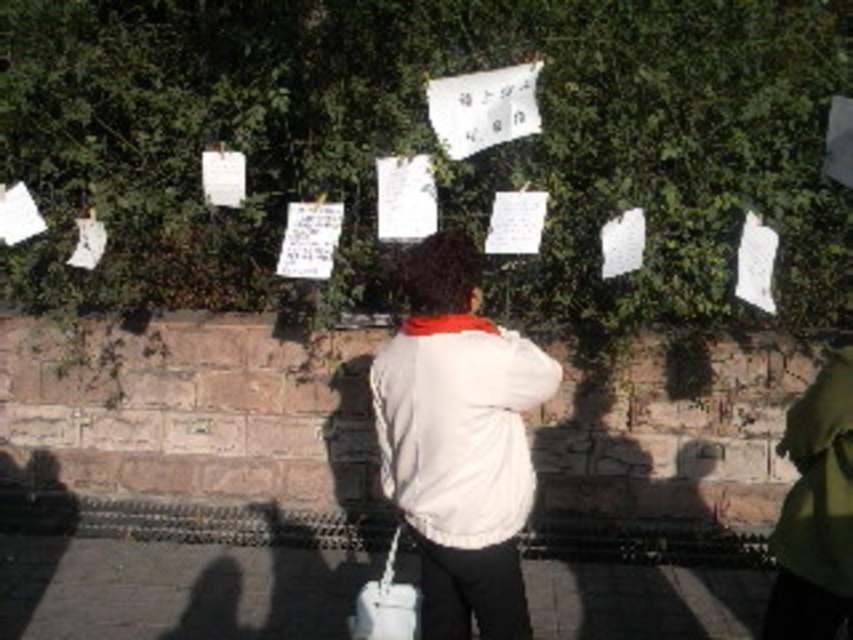
Question: Does white fabric jacket at center have a lesser width compared to white fabric at center?

Choices:
 (A) no
 (B) yes

Answer: (A)

Question: Can you confirm if white fabric jacket at center is positioned to the right of white fabric at center?

Choices:
 (A) no
 (B) yes

Answer: (A)

Question: Is green leafy hedge at upper center to the left of white fabric at center from the viewer's perspective?

Choices:
 (A) no
 (B) yes

Answer: (B)

Question: Estimate the real-world distances between objects in this image. Which object is closer to the white fabric at center?

Choices:
 (A) white fabric jacket at center
 (B) green leafy hedge at upper center

Answer: (A)

Question: Which point is closer to the camera?

Choices:
 (A) (795, 602)
 (B) (125, 128)
 (C) (463, 518)

Answer: (C)

Question: Which object is the closest to the white fabric jacket at center?

Choices:
 (A) white fabric at center
 (B) green leafy hedge at upper center

Answer: (A)